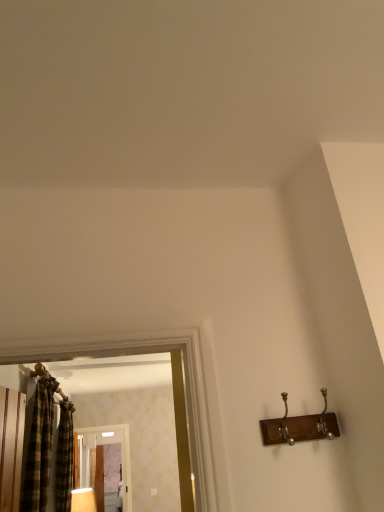
Question: From a real-world perspective, is wooden hanger at upper left positioned above or below plaid fabric shower curtain at left?

Choices:
 (A) above
 (B) below

Answer: (A)

Question: Considering the positions of wooden hanger at upper left and plaid fabric shower curtain at left in the image, is wooden hanger at upper left bigger or smaller than plaid fabric shower curtain at left?

Choices:
 (A) small
 (B) big

Answer: (A)

Question: Which of these objects is positioned closest to the plaid fabric shower curtain at left?

Choices:
 (A) plaid fabric curtain at left
 (B) matte wooden lamp at lower left
 (C) wooden hanger at upper left
 (D) clear glass screen door at center

Answer: (A)

Question: Which object is the farthest from the matte wooden lamp at lower left?

Choices:
 (A) wooden hanger at upper left
 (B) plaid fabric curtain at left
 (C) plaid fabric shower curtain at left
 (D) clear glass screen door at center

Answer: (A)